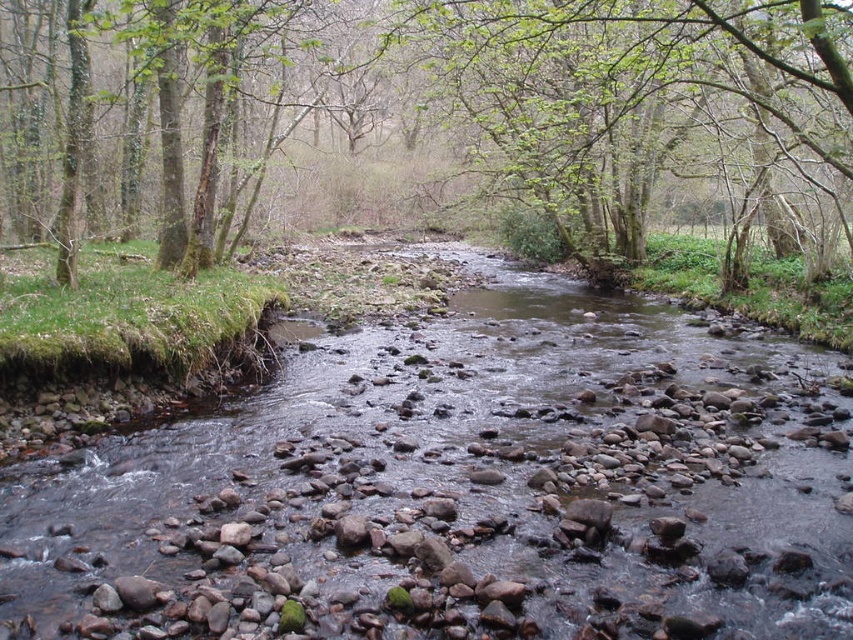
Between smooth rock stream at center and green mossy tree at center, which one has more height?

With more height is green mossy tree at center.

The height and width of the screenshot is (640, 853). Identify the location of smooth rock stream at center. (457, 488).